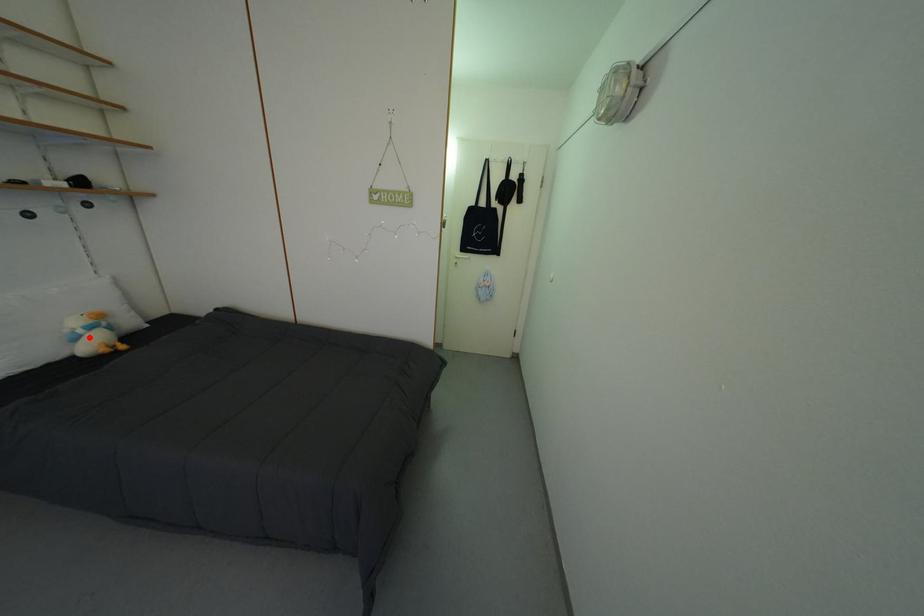
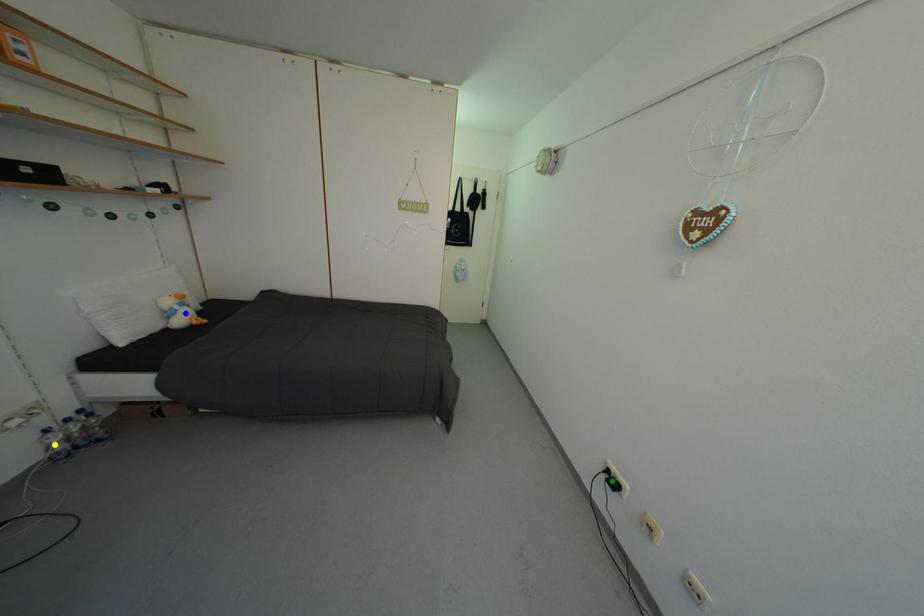
Question: I am providing you with two images of the same scene from different viewpoints. A red point is marked on the first image. You are given multiple points on the second image. Which point in image 2 represents the same 3d spot as the red point in image 1?

Choices:
 (A) green point
 (B) yellow point
 (C) blue point

Answer: (C)